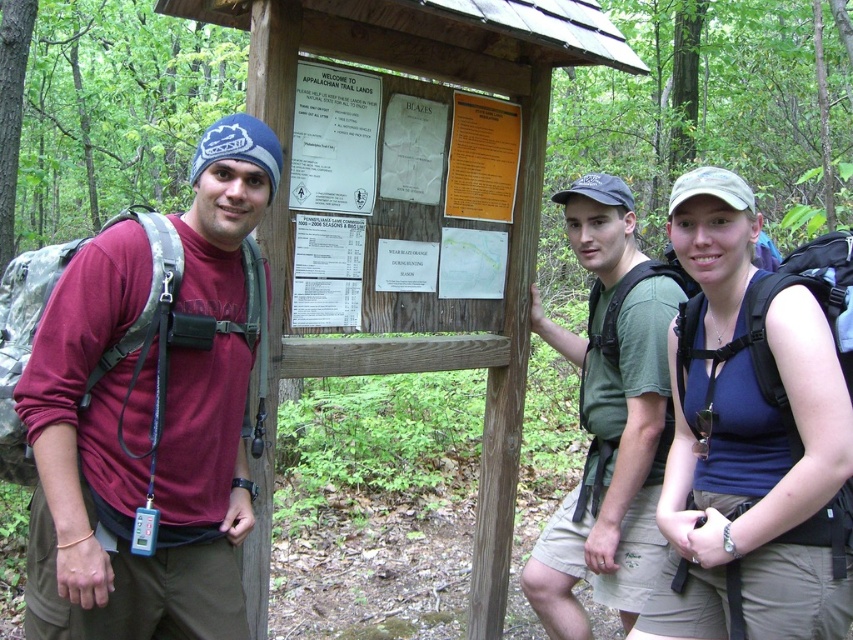
Which is above, maroon fabric shirt at left or green fabric shirt at center?

Positioned higher is maroon fabric shirt at left.

Consider the image. Who is shorter, maroon fabric shirt at left or green fabric shirt at center?

maroon fabric shirt at left is shorter.

Which is behind, point (152, 456) or point (622, 442)?

Positioned behind is point (622, 442).

Find the location of a particular element. maroon fabric shirt at left is located at coordinates (141, 404).

Between maroon fabric shirt at left and blue fabric shirt at center, which one is positioned higher?

maroon fabric shirt at left

Between maroon fabric shirt at left and blue fabric shirt at center, which one appears on the right side from the viewer's perspective?

From the viewer's perspective, blue fabric shirt at center appears more on the right side.

Find the location of `maroon fabric shirt at left`. maroon fabric shirt at left is located at coordinates (141, 404).

Identify the location of maroon fabric shirt at left. [x=141, y=404].

Which of these two, blue fabric shirt at center or green fabric shirt at center, stands taller?

Standing taller between the two is green fabric shirt at center.

Is point (734, 520) positioned behind point (601, 468)?

No, (734, 520) is closer to viewer.

I want to click on blue fabric shirt at center, so click(753, 433).